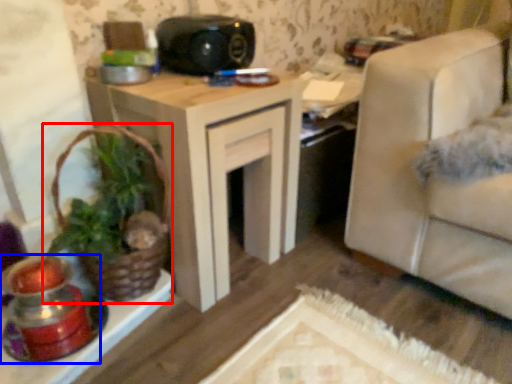
Question: Which object is closer to the camera taking this photo, houseplant (highlighted by a red box) or candle holder (highlighted by a blue box)?

Choices:
 (A) houseplant
 (B) candle holder

Answer: (B)